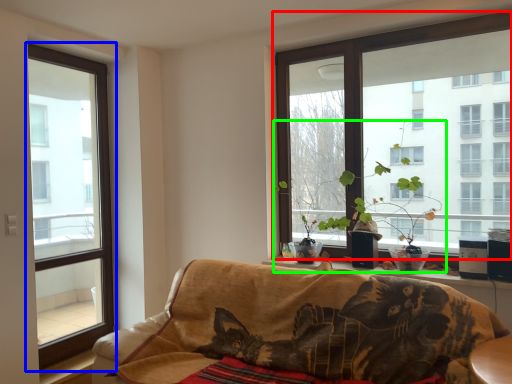
Question: Based on their relative distances, which object is farther from window (highlighted by a red box)? Choose from window (highlighted by a blue box) and houseplant (highlighted by a green box).

Choices:
 (A) window
 (B) houseplant

Answer: (A)